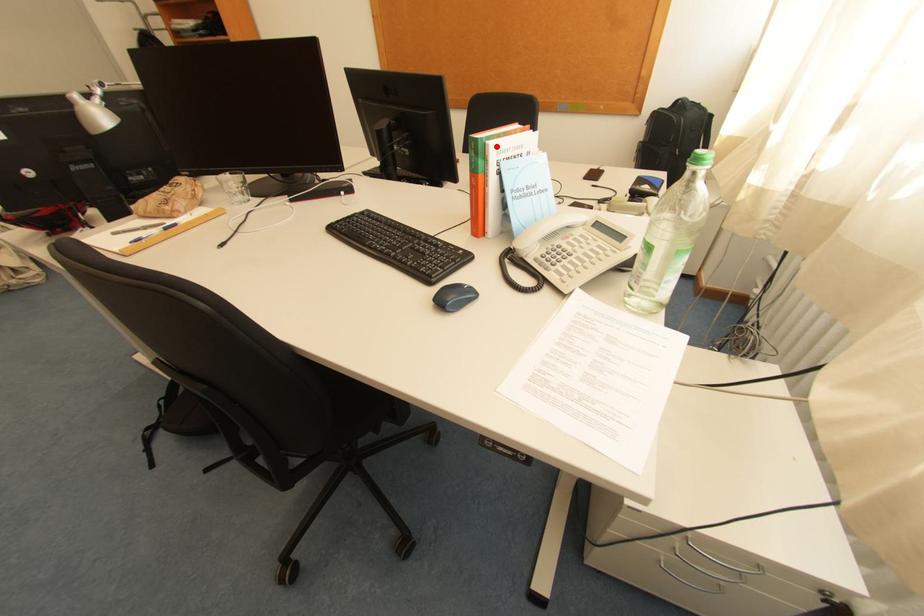
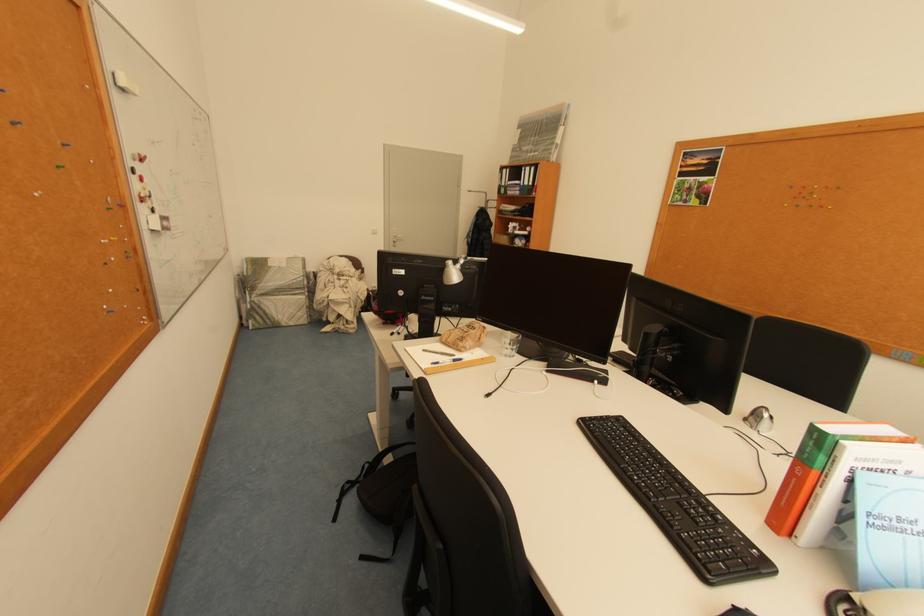
Find the pixel in the second image that matches the highlighted location in the first image.

(853, 448)